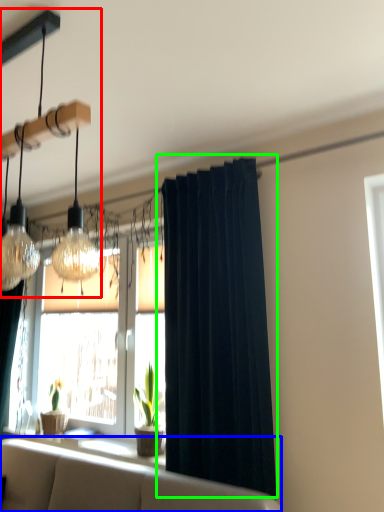
Question: Which is farther away from lamp (highlighted by a red box)? studio couch (highlighted by a blue box) or curtain (highlighted by a green box)?

Choices:
 (A) studio couch
 (B) curtain

Answer: (A)